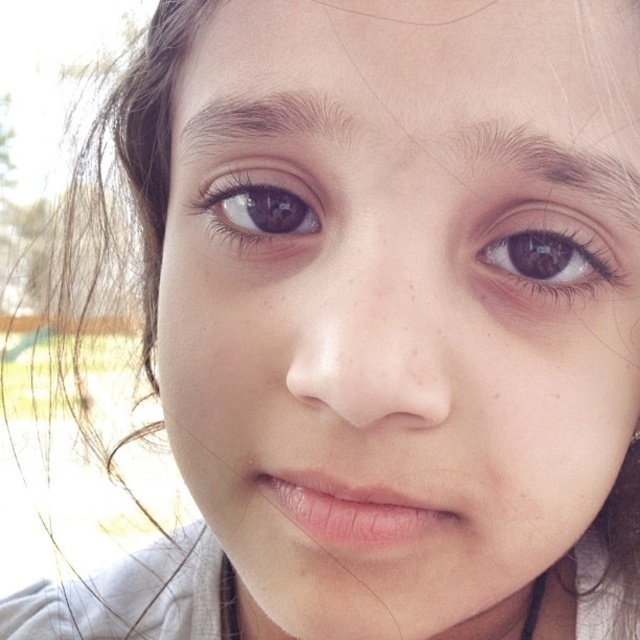
Who is positioned more to the left, brown matte eye at upper right or dark brown hair at upper right?

dark brown hair at upper right

Is brown matte eye at upper right closer to the viewer compared to dark brown hair at upper right?

No.

Measure the distance between point (529, 246) and camera.

Point (529, 246) is 11.47 inches away from camera.

Image resolution: width=640 pixels, height=640 pixels. I want to click on brown matte eye at upper right, so click(548, 252).

Which is behind, point (532, 284) or point (257, 193)?

Point (257, 193)

Can you confirm if brown matte eye at upper right is bigger than brown matte eye at upper left?

Incorrect, brown matte eye at upper right is not larger than brown matte eye at upper left.

Is point (557, 291) in front of point (250, 218)?

Yes, it is in front of point (250, 218).

I want to click on brown matte eye at upper right, so click(x=548, y=252).

Does point (520, 128) come closer to viewer compared to point (310, 122)?

That is True.

Is point (557, 179) behind point (317, 104)?

No, (557, 179) is closer to viewer.

Between point (460, 136) and point (243, 125), which one is positioned in front?

Point (460, 136)

This screenshot has width=640, height=640. I want to click on dark brown hair at upper right, so click(x=556, y=163).